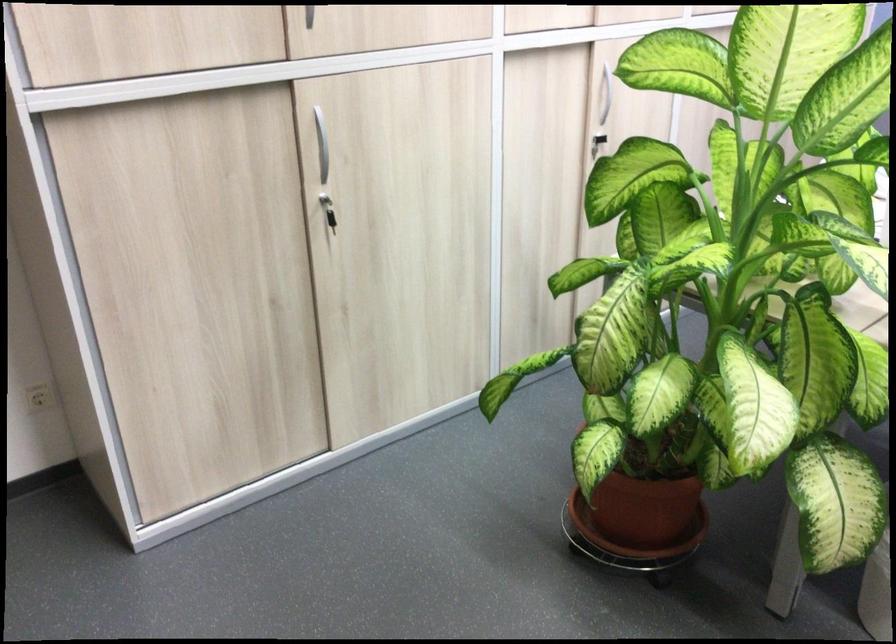
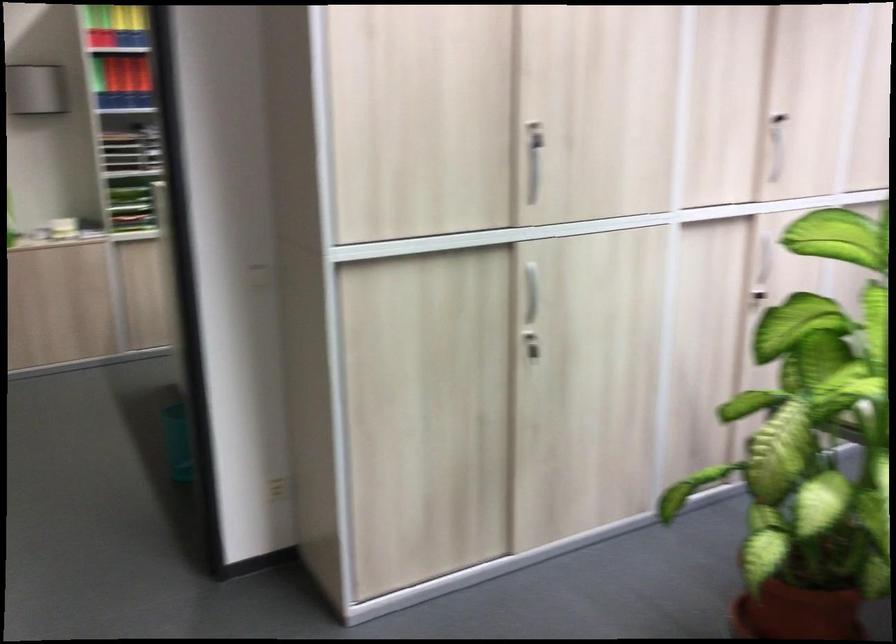
In the second image, find the point that corresponds to point (328, 213) in the first image.

(530, 345)